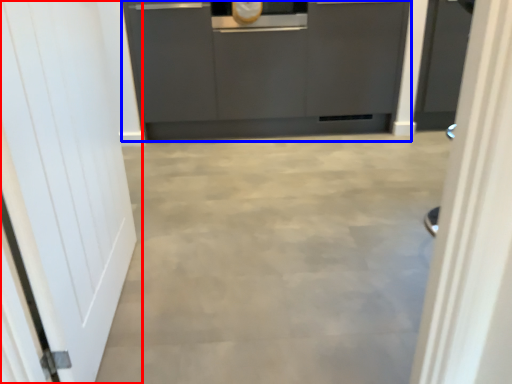
Question: Which object is further to the camera taking this photo, door (highlighted by a red box) or cabinetry (highlighted by a blue box)?

Choices:
 (A) door
 (B) cabinetry

Answer: (B)